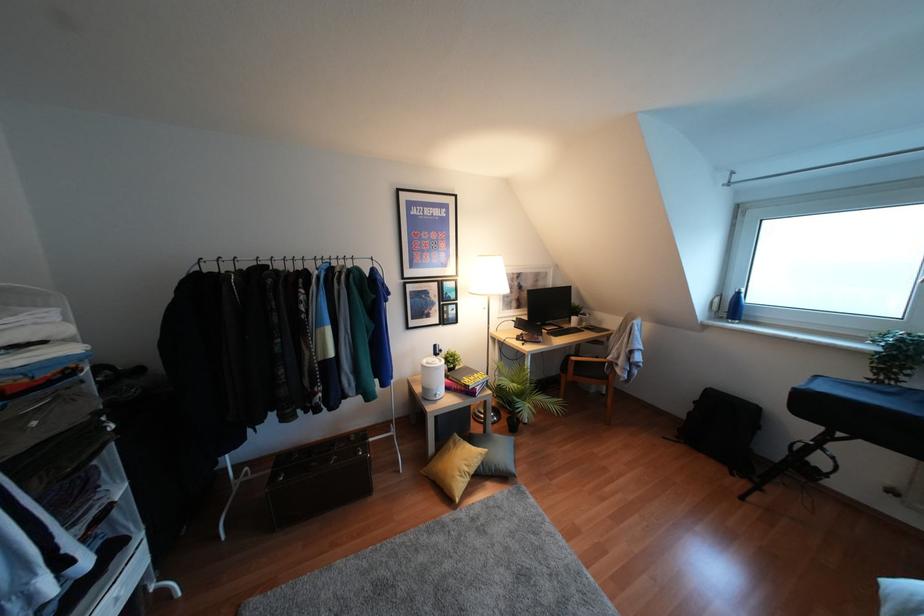
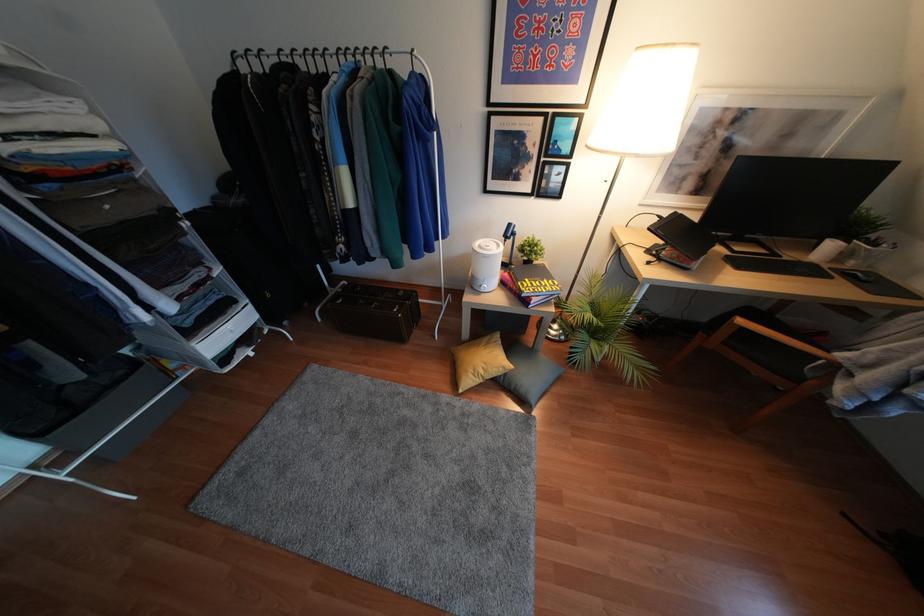
The point at (517, 323) is marked in the first image. Where is the corresponding point in the second image?

(666, 224)